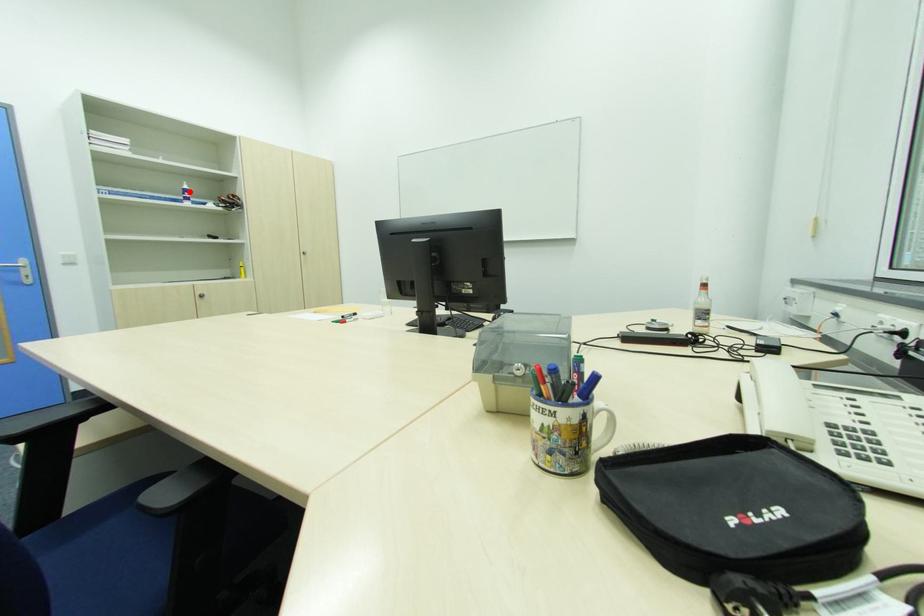
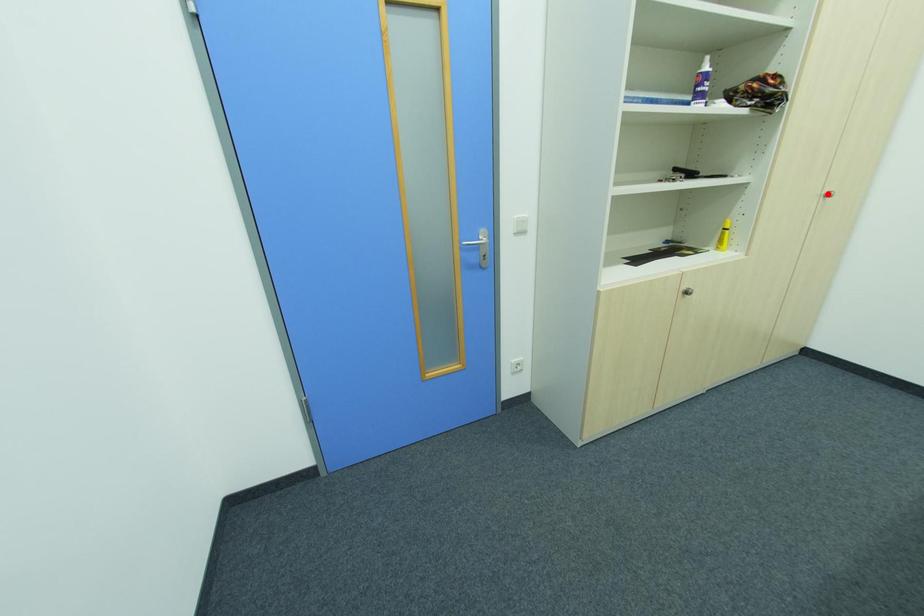
I am providing you with two images of the same scene from different viewpoints. A red point is marked on the first image and another point is marked on the second image. Is the red point in image1 aligned with the point shown in image2?

No